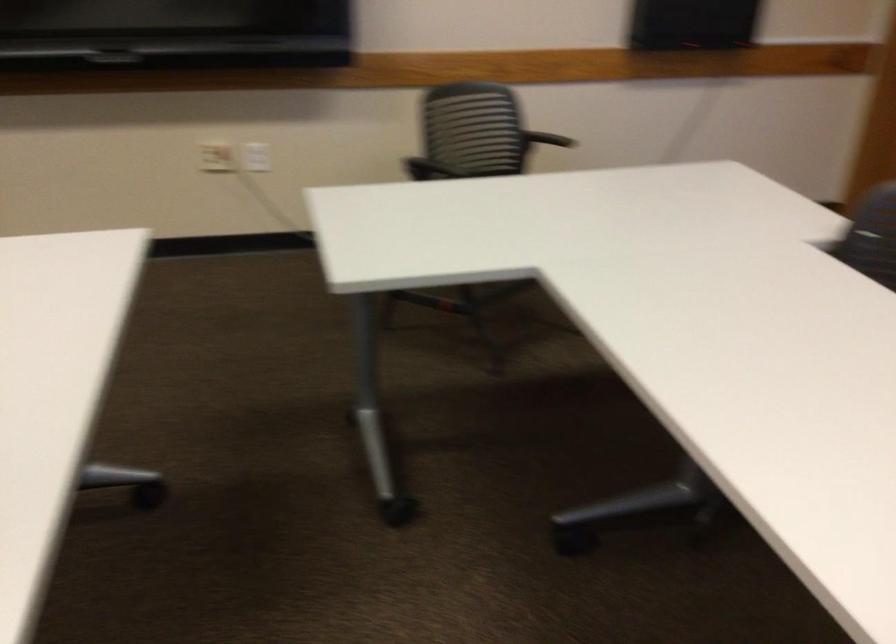
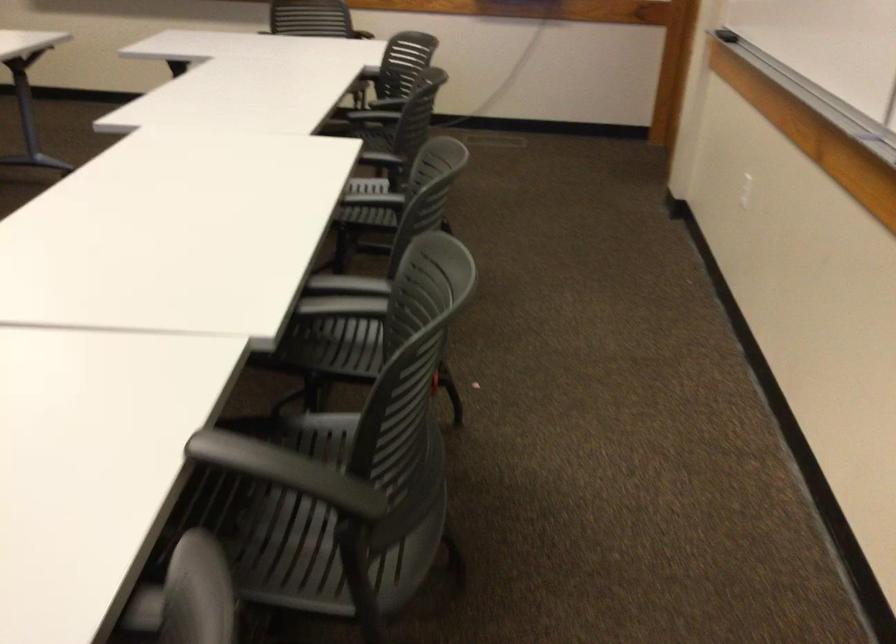
What movement of the cameraman would produce the second image?

The movement direction of the cameraman is right, backward.